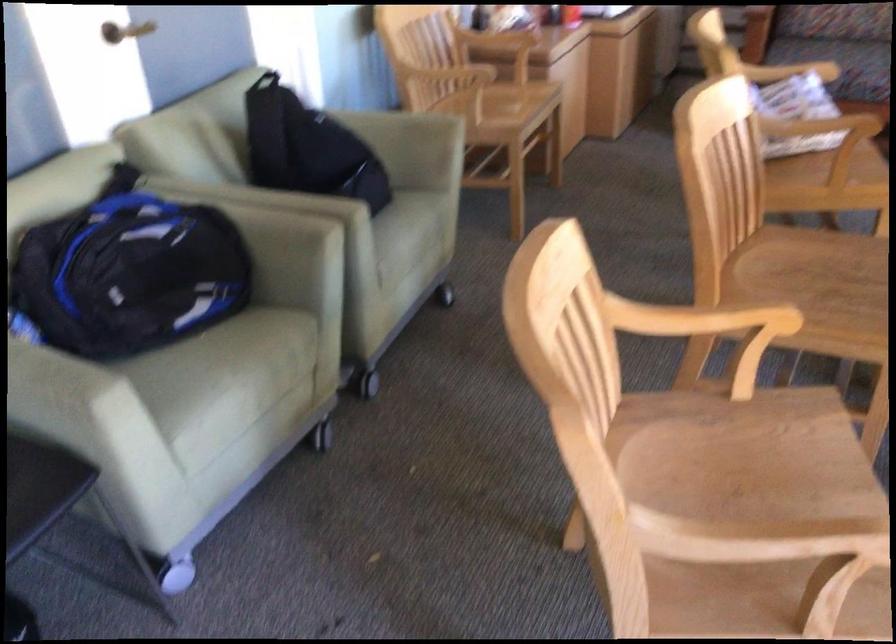
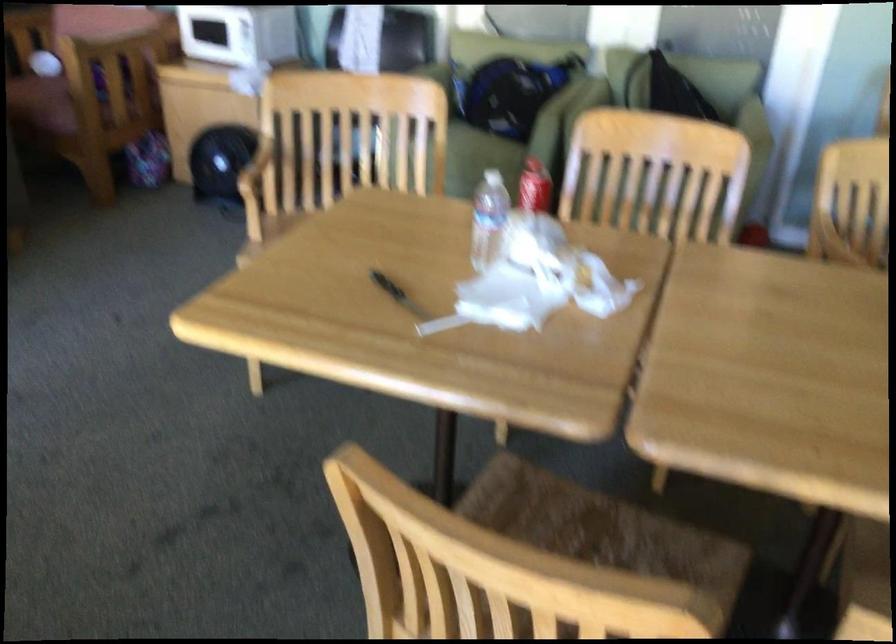
Find the pixel in the second image that matches point (274, 351) in the first image.

(479, 160)